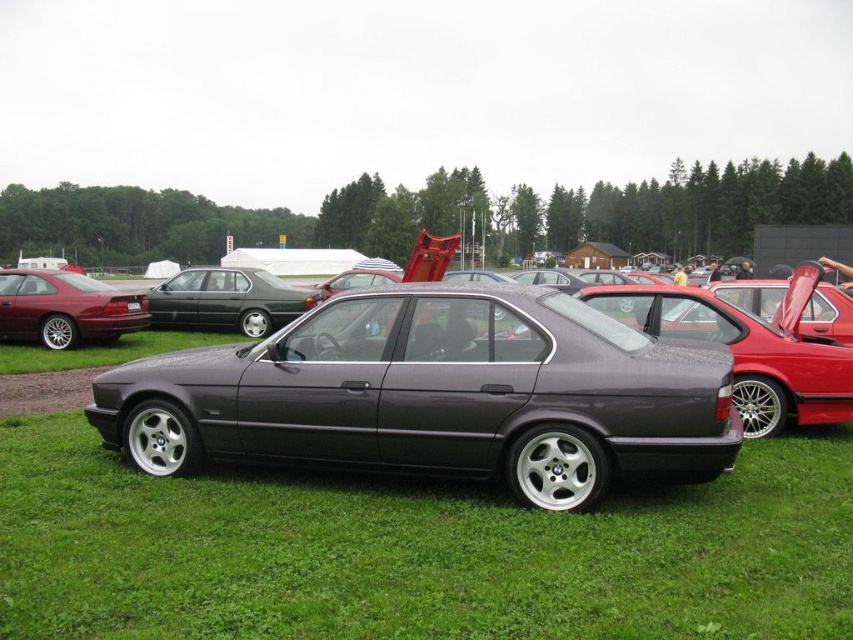
You are at a car exhibition and want to know which car is bigger between the shiny red car at left and the satin black sedan at center. Can you tell me?

The shiny red car at left has a smaller size compared to the satin black sedan at center, so the satin black sedan at center is bigger.

From the picture: You are a photographer at the car show and want to capture a photo of the shiny red car at left and the satin black sedan at center. From your current position, can you see both cars fully without any obstruction?

The shiny red car at left is in front of the satin black sedan at center, so the shiny red car at left may block part of the view of the satin black sedan at center. Therefore, you might not be able to see both cars fully without any obstruction.

You are a photographer at the car show. You want to capture a wide shot of the entire scene, including the satin metallic sedan at center and the other cars in the background. Based on the sedan position at point 0.617, 0.512, where should you position your camera to ensure the sedan is centered in the frame while still including the other cars in the background?

To center the satin metallic sedan at center while including the background cars, position the camera so the sedan aligns with the frame center at coordinates (x=436, y=394). This placement ensures the sedan remains focal while the background vehicles stay visible in the shot.